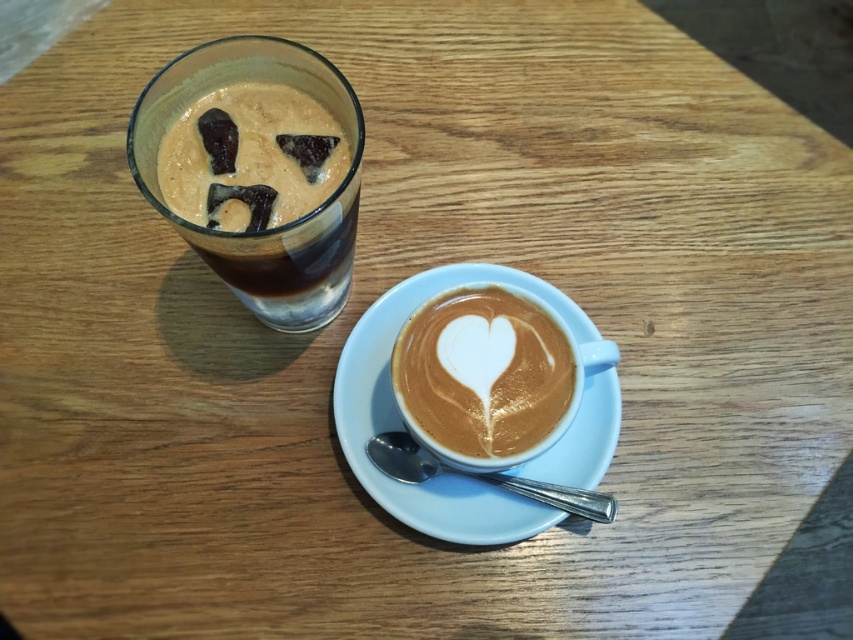
Consider the image. You are a customer at the cafe and want to reach for the matte brown glass at upper left and the white frothy latte art at center. Which one is closer to you?

The white frothy latte art at center is closer to you since it is below the matte brown glass at upper left, which is positioned above it.

You are a barista trying to arrange two items on a shelf. The matte brown glass at upper left and the white frothy latte art at center must be placed side by side. Given their widths, which item should you place first to ensure they fit properly?

The matte brown glass at upper left is wider than the white frothy latte art at center. Therefore, you should place the matte brown glass at upper left first to accommodate its greater width before positioning the narrower white frothy latte art at center.

You are a barista who needs to place a new drink order on the table. The order requires placing a hot beverage on top of the white ceramic saucer at center. Can you do this without moving the existing white frothy latte art at center?

The white ceramic saucer at center is below the white frothy latte art at center, so the latte art is already on the saucer. Therefore, you cannot place another hot beverage on the saucer without disturbing the existing latte art.